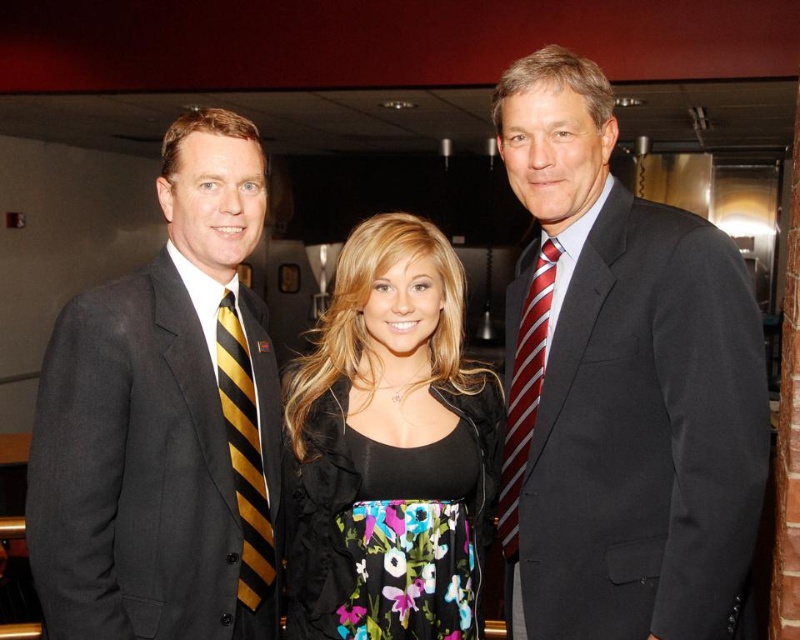
Can you confirm if floral dress at center is thinner than red striped tie at right?

No.

Consider the image. Who is more distant from viewer, (376, 492) or (512, 496)?

Point (512, 496)

Find the location of a particular element. This screenshot has height=640, width=800. floral dress at center is located at coordinates (389, 449).

Between black suit at left and red striped tie at right, which one is positioned higher?

black suit at left is higher up.

Does black suit at left have a lesser height compared to red striped tie at right?

Incorrect, black suit at left's height does not fall short of red striped tie at right's.

Between point (184, 465) and point (544, 326), which one is positioned behind?

The point (544, 326) is more distant.

Find the location of a particular element. black suit at left is located at coordinates (164, 420).

Does matte black suit at center appear over red striped tie at right?

Correct, matte black suit at center is located above red striped tie at right.

Consider the image. Can you confirm if matte black suit at center is taller than red striped tie at right?

Correct, matte black suit at center is much taller as red striped tie at right.

Between point (617, 202) and point (528, 426), which one is positioned behind?

The point (528, 426) is behind.

The image size is (800, 640). In order to click on matte black suit at center in this screenshot , I will do `click(620, 387)`.